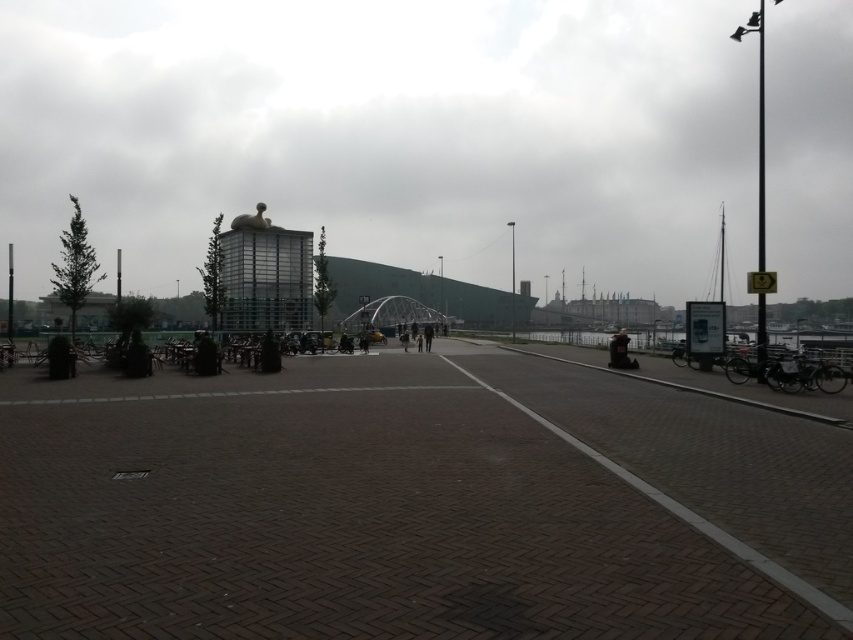
You are standing at the center of the paved area and want to find the dark gray stone statue at lower right. Based on the coordinates given, in which direction should you walk to locate it?

The dark gray stone statue at lower right is located at coordinates 0.550 on the x axis and 0.728 on the y axis. Since you are at the center, you should walk towards the lower right direction to reach it.

You are a city planner evaluating the layout of this urban waterfront area. You need to install a new bench that can comfortably seat 4 people, requiring 3 meters of space. Is there enough space between the transparent glass building at center and the dark gray stone statue at lower right to place the bench without moving any existing objects?

The transparent glass building at center and the dark gray stone statue at lower right are 235.01 meters apart, so yes, there is more than enough space between them to place the bench requiring 3 meters of space without moving any existing objects.